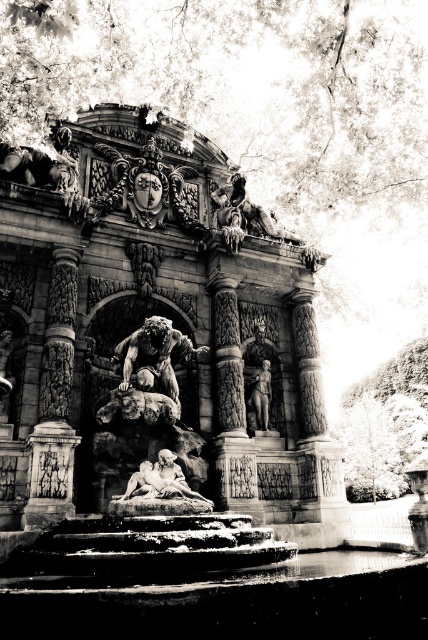
Does carved stone column at left have a greater height compared to polished bronze statue at center?

Indeed, carved stone column at left has a greater height compared to polished bronze statue at center.

Does carved stone column at left appear under polished bronze statue at center?

No, carved stone column at left is not below polished bronze statue at center.

Find the location of a particular element. The image size is (428, 640). carved stone column at left is located at coordinates (55, 400).

I want to click on carved stone column at left, so click(x=55, y=400).

Find the location of a particular element. This screenshot has width=428, height=640. carved stone column at left is located at coordinates (55, 400).

Does carved stone column at left have a greater width compared to carved stone column at center?

Indeed, carved stone column at left has a greater width compared to carved stone column at center.

You are a GUI agent. You are given a task and a screenshot of the screen. Output one action in this format:
    pyautogui.click(x=<x>, y=<y>)
    Task: Click on the carved stone column at left
    This screenshot has height=640, width=428.
    Given the screenshot: What is the action you would take?
    pyautogui.click(x=55, y=400)

Image resolution: width=428 pixels, height=640 pixels. What are the coordinates of `carved stone column at left` in the screenshot? It's located at pos(55,400).

Is carved stone column at center taller than matte stone sculpture at center?

Correct, carved stone column at center is much taller as matte stone sculpture at center.

Between carved stone column at center and matte stone sculpture at center, which one is positioned higher?

carved stone column at center

Is point (217, 403) in front of point (142, 496)?

No, (217, 403) is further to viewer.

Identify the location of carved stone column at center. (226, 358).